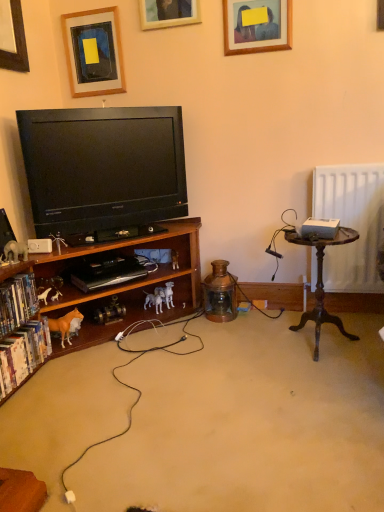
At what (x,y) coordinates should I click in order to perform the action: click on free space between wooden vintage table at right and copper glass lantern at center, acting as the 4th toy starting from the left. Please return your answer as a coordinate pair (x, y). Looking at the image, I should click on (260, 330).